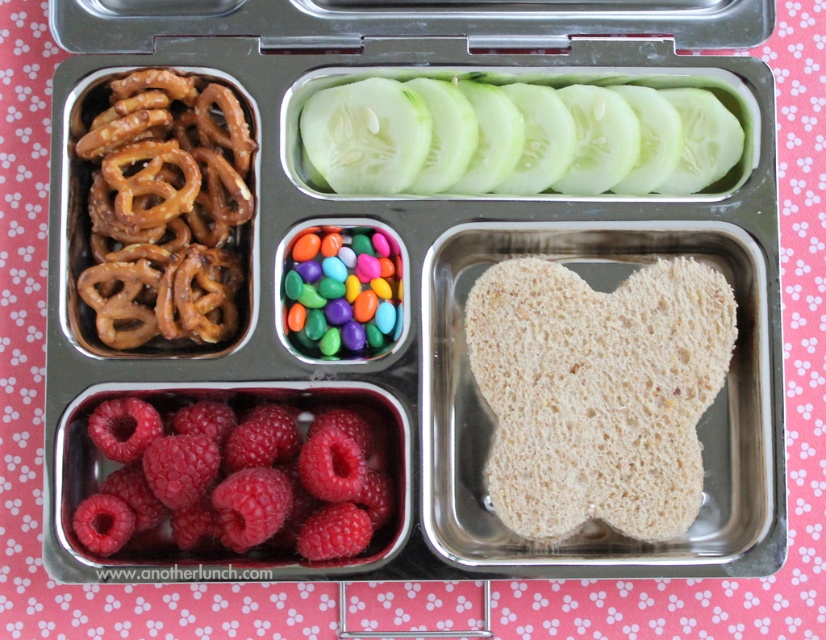
Who is positioned more to the right, white bread at center or brown crunchy pretzels at left?

white bread at center is more to the right.

Is point (544, 282) farther from camera compared to point (140, 116)?

Yes.

Is point (516, 404) less distant than point (141, 81)?

No, (516, 404) is further to viewer.

Identify the location of white bread at center. (597, 392).

What do you see at coordinates (516, 138) in the screenshot? The image size is (826, 640). I see `green smooth cucumber slices at upper center` at bounding box center [516, 138].

Does green smooth cucumber slices at upper center have a lesser width compared to brown crunchy pretzels at left?

In fact, green smooth cucumber slices at upper center might be wider than brown crunchy pretzels at left.

Find the location of `green smooth cucumber slices at upper center`. green smooth cucumber slices at upper center is located at coordinates (516, 138).

Can you confirm if green smooth cucumber slices at upper center is shorter than bright red raspberry at bottom left?

Correct, green smooth cucumber slices at upper center is not as tall as bright red raspberry at bottom left.

You are a GUI agent. You are given a task and a screenshot of the screen. Output one action in this format:
    pyautogui.click(x=<x>, y=<y>)
    Task: Click on the green smooth cucumber slices at upper center
    The image size is (826, 640).
    Given the screenshot: What is the action you would take?
    pyautogui.click(x=516, y=138)

At what (x,y) coordinates should I click in order to perform the action: click on green smooth cucumber slices at upper center. Please return your answer as a coordinate pair (x, y). This screenshot has height=640, width=826. Looking at the image, I should click on (516, 138).